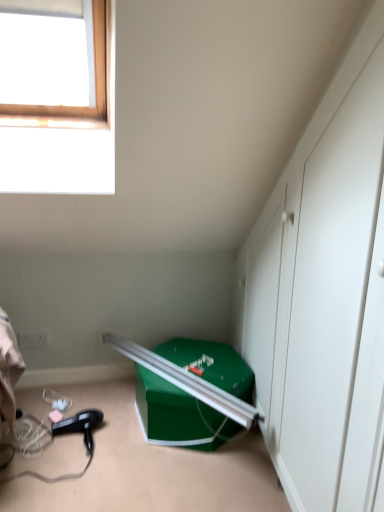
Locate an element on the screen. This screenshot has width=384, height=512. vacant space in front of green cardboard box at lower right is located at coordinates (180, 478).